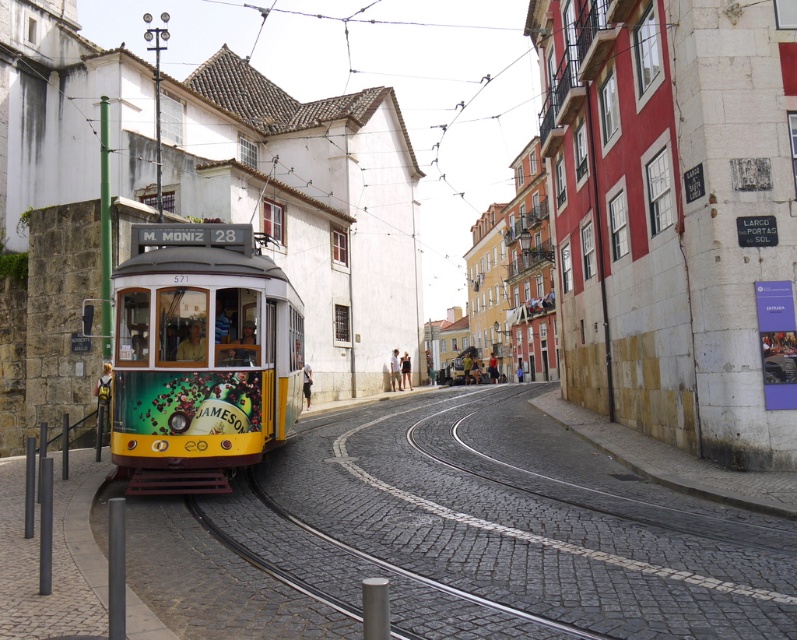
Looking at this image, can you confirm if yellow rubber track at lower left is wider than yellow polished metal tram at left?

Yes.

Consider the image. Who is higher up, yellow rubber track at lower left or yellow polished metal tram at left?

yellow polished metal tram at left

What do you see at coordinates (501, 529) in the screenshot? I see `yellow rubber track at lower left` at bounding box center [501, 529].

Locate an element on the screen. This screenshot has width=797, height=640. yellow rubber track at lower left is located at coordinates (501, 529).